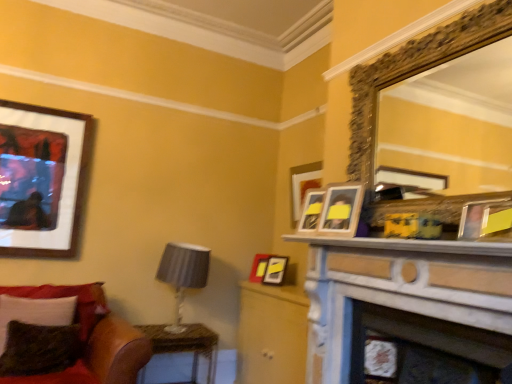
The image size is (512, 384). What do you see at coordinates (303, 185) in the screenshot?
I see `wooden picture frame at upper center, which is counted as the 4th picture frame, starting from the front` at bounding box center [303, 185].

What do you see at coordinates (183, 274) in the screenshot? I see `satin gray lampshade at lower left` at bounding box center [183, 274].

Locate an element on the screen. Image resolution: width=512 pixels, height=384 pixels. gold ornate mirror at upper right is located at coordinates (414, 70).

What is the approximate height of matte yellow picture frame at upper right, marked as the 5th picture frame in a back-to-front arrangement?

matte yellow picture frame at upper right, marked as the 5th picture frame in a back-to-front arrangement, is 20.50 centimeters tall.

The image size is (512, 384). Find the location of `matte wood dresser at center`. matte wood dresser at center is located at coordinates (271, 334).

This screenshot has width=512, height=384. What are the coordinates of `velvet red couch at lower left` in the screenshot? It's located at (92, 339).

From a real-world perspective, which object rests below the other?

velvet red couch at lower left, from a real-world perspective.

Between velvet red couch at lower left and matte yellow picture frame at upper right, marked as the 5th picture frame in a back-to-front arrangement, which one has larger size?

Bigger between the two is velvet red couch at lower left.

Which of these two, velvet red couch at lower left or matte yellow picture frame at upper right, which is counted as the fifth picture frame, starting from the left, stands shorter?

matte yellow picture frame at upper right, which is counted as the fifth picture frame, starting from the left, is shorter.

Considering the sizes of wooden photo frame at upper right, which ranks as the 2th picture frame in front-to-back order, and matte wood dresser at center in the image, is wooden photo frame at upper right, which ranks as the 2th picture frame in front-to-back order, taller or shorter than matte wood dresser at center?

In the image, wooden photo frame at upper right, which ranks as the 2th picture frame in front-to-back order, appears to be shorter than matte wood dresser at center.

I want to click on picture frame that is the 2nd object located above the matte wood dresser at center (from the image's perspective), so click(x=341, y=209).

Between wooden photo frame at upper right, placed as the second picture frame when sorted from right to left, and matte wood dresser at center, which one is positioned in front?

Positioned in front is wooden photo frame at upper right, placed as the second picture frame when sorted from right to left.

Is velvet red couch at lower left outside of matte wood dresser at center?

Yes.

Which object is further away from the camera taking this photo, velvet red couch at lower left or matte wood dresser at center?

matte wood dresser at center is further from the camera.

The height and width of the screenshot is (384, 512). What are the coordinates of `studio couch in front of the matte wood dresser at center` in the screenshot? It's located at (92, 339).

Is gold ornate mirror at upper right inside or outside of wooden photo frame at upper right, which ranks as the 2th picture frame in front-to-back order?

gold ornate mirror at upper right is not inside wooden photo frame at upper right, which ranks as the 2th picture frame in front-to-back order, it's outside.

Does point (417, 57) lie behind point (327, 224)?

No.

Can you confirm if gold ornate mirror at upper right is bigger than wooden photo frame at upper right, which ranks as the 2th picture frame in front-to-back order?

Yes, gold ornate mirror at upper right is bigger than wooden photo frame at upper right, which ranks as the 2th picture frame in front-to-back order.

Consider the image. Which object is closer to the camera, gold ornate mirror at upper right or wooden photo frame at upper right, arranged as the fourth picture frame when viewed from the back?

gold ornate mirror at upper right is in front.

Looking at this image, is there a large distance between gold ornate mirror at upper right and matte yellow picture frame at upper right, marked as the 5th picture frame in a back-to-front arrangement?

No.

Which object is further away from the camera, gold ornate mirror at upper right or matte yellow picture frame at upper right, marked as the 5th picture frame in a back-to-front arrangement?

Positioned behind is gold ornate mirror at upper right.

There is a velvet green pillow at lower left, the first pillow positioned from the front. Where is `table lamp above it (from a real-world perspective)`? table lamp above it (from a real-world perspective) is located at coordinates (183, 274).

Is point (197, 248) farther from camera compared to point (7, 335)?

Yes.

Which object is closer to the camera, satin gray lampshade at lower left or velvet green pillow at lower left, the first pillow positioned from the front?

velvet green pillow at lower left, the first pillow positioned from the front, is closer to the camera.

Could you tell me if satin gray lampshade at lower left is facing velvet green pillow at lower left, the first pillow positioned from the front?

No, satin gray lampshade at lower left is not facing towards velvet green pillow at lower left, the first pillow positioned from the front.

From the image's perspective, would you say wooden table at lower left is shown under velvety green pillow at lower left, which ranks as the second pillow in front-to-back order?

Yes.

From a real-world perspective, which object stands above the other?

velvety green pillow at lower left, which ranks as the second pillow in front-to-back order.

Between wooden table at lower left and velvety green pillow at lower left, positioned as the 1th pillow in back-to-front order, which one appears on the left side from the viewer's perspective?

From the viewer's perspective, velvety green pillow at lower left, positioned as the 1th pillow in back-to-front order, appears more on the left side.

Is there a large distance between wooden table at lower left and velvety green pillow at lower left, positioned as the 1th pillow in back-to-front order?

No, wooden table at lower left is not far away from velvety green pillow at lower left, positioned as the 1th pillow in back-to-front order.

Find the location of a particular element. This screenshot has width=512, height=384. studio couch below the matte yellow picture frame at upper right, which is the 1th picture frame from front to back (from the image's perspective) is located at coordinates (92, 339).

You are a GUI agent. You are given a task and a screenshot of the screen. Output one action in this format:
    pyautogui.click(x=<x>, y=<y>)
    Task: Click on the dresser behind the wooden photo frame at upper right, placed as the second picture frame when sorted from right to left
    This screenshot has width=512, height=384.
    Given the screenshot: What is the action you would take?
    pyautogui.click(x=271, y=334)

Considering their positions, is wooden photo frame at upper right, which ranks as the 2th picture frame in front-to-back order, positioned closer to velvet red couch at lower left than gold ornate mirror at upper right?

Based on the image, wooden photo frame at upper right, which ranks as the 2th picture frame in front-to-back order, appears to be nearer to velvet red couch at lower left.

Which object lies further to the anchor point wooden table at lower left, gold ornate mirror at upper right or white marble fireplace at center?

Based on the image, gold ornate mirror at upper right appears to be further to wooden table at lower left.

From the image, which object appears to be farther from gold ornate mirror at upper right, matte yellow picture frame at upper right, which is the 1th picture frame from front to back, or wooden table at lower left?

wooden table at lower left is positioned further to the anchor gold ornate mirror at upper right.

When comparing their distances from gold ornate mirror at upper right, does wooden photo frame at upper right, arranged as the fourth picture frame when viewed from the back, or white marble fireplace at center seem further?

white marble fireplace at center lies further to gold ornate mirror at upper right than the other object.

Based on their spatial positions, is gold ornate mirror at upper right or velvet red couch at lower left further from matte wood dresser at center?

gold ornate mirror at upper right is positioned further to the anchor matte wood dresser at center.

Which object lies further to the anchor point wooden table at lower left, satin gray lampshade at lower left or velvet red couch at lower left?

Based on the image, velvet red couch at lower left appears to be further to wooden table at lower left.

Which object lies further to the anchor point wooden photo frame at upper right, arranged as the fourth picture frame when viewed from the back, matte wood dresser at center or wooden picture frame at upper center, which appears as the third picture frame when viewed from the right?

Based on the image, matte wood dresser at center appears to be further to wooden photo frame at upper right, arranged as the fourth picture frame when viewed from the back.

Which object lies nearer to the anchor point matte wood dresser at center, matte black picture frame at center, the 1th picture frame from the back, or matte black frame at upper left, acting as the 3th picture frame starting from the back?

matte black picture frame at center, the 1th picture frame from the back, is closer to matte wood dresser at center.

Identify the location of dresser located between velvet red couch at lower left and white marble fireplace at center in the left-right direction. (271, 334).

Image resolution: width=512 pixels, height=384 pixels. I want to click on table between velvet green pillow at lower left, the first pillow positioned from the front, and matte wood dresser at center, in the horizontal direction, so click(186, 345).

Image resolution: width=512 pixels, height=384 pixels. Find the location of `table between matte black frame at upper left, the fifth picture frame when ordered from right to left, and matte yellow picture frame at upper right, the 1th picture frame positioned from the right, in the horizontal direction`. table between matte black frame at upper left, the fifth picture frame when ordered from right to left, and matte yellow picture frame at upper right, the 1th picture frame positioned from the right, in the horizontal direction is located at coordinates (186, 345).

Locate an element on the screen. table between gold ornate mirror at upper right and satin gray lampshade at lower left along the z-axis is located at coordinates (186, 345).